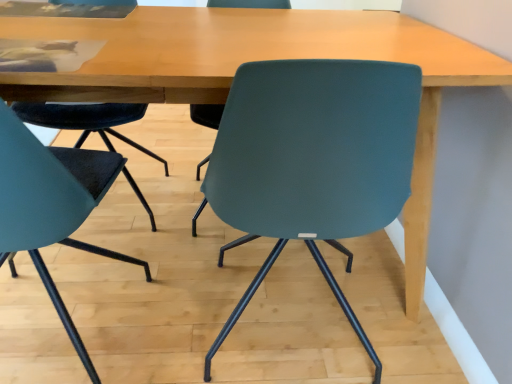
Question: Is the depth of teal matte chair at center, the 1th chair when ordered from right to left, less than that of teal matte chair at left, the 2th chair viewed from the right?

Choices:
 (A) no
 (B) yes

Answer: (A)

Question: Is the surface of teal matte chair at center, which is the 2th chair from left to right, in direct contact with teal matte chair at left, the 2th chair viewed from the right?

Choices:
 (A) no
 (B) yes

Answer: (A)

Question: Does teal matte chair at center, which is the 2th chair from left to right, have a smaller size compared to teal matte chair at left, positioned as the first chair in left-to-right order?

Choices:
 (A) yes
 (B) no

Answer: (B)

Question: Considering the relative sizes of teal matte chair at center, which is the 2th chair from left to right, and teal matte chair at left, positioned as the first chair in left-to-right order, in the image provided, is teal matte chair at center, which is the 2th chair from left to right, shorter than teal matte chair at left, positioned as the first chair in left-to-right order,?

Choices:
 (A) yes
 (B) no

Answer: (A)

Question: Is teal matte chair at center, the 1th chair when ordered from right to left, not inside teal matte chair at left, positioned as the first chair in left-to-right order?

Choices:
 (A) no
 (B) yes

Answer: (B)

Question: Can you confirm if teal matte chair at center, the 1th chair when ordered from right to left, is thinner than teal matte chair at left, the 2th chair viewed from the right?

Choices:
 (A) yes
 (B) no

Answer: (B)

Question: Can you confirm if teal matte chair at left, the 2th chair viewed from the right, is taller than teal matte chair at center, which is the 2th chair from left to right?

Choices:
 (A) yes
 (B) no

Answer: (A)

Question: Can you confirm if teal matte chair at left, positioned as the first chair in left-to-right order, is positioned to the right of teal matte chair at center, which is the 2th chair from left to right?

Choices:
 (A) no
 (B) yes

Answer: (A)

Question: Are teal matte chair at left, the 2th chair viewed from the right, and teal matte chair at center, which is the 2th chair from left to right, far apart?

Choices:
 (A) no
 (B) yes

Answer: (A)

Question: Considering the relative positions of teal matte chair at left, the 2th chair viewed from the right, and teal matte chair at center, the 1th chair when ordered from right to left, in the image provided, is teal matte chair at left, the 2th chair viewed from the right, to the left of teal matte chair at center, the 1th chair when ordered from right to left, from the viewer's perspective?

Choices:
 (A) no
 (B) yes

Answer: (B)

Question: Does teal matte chair at left, positioned as the first chair in left-to-right order, have a lesser height compared to teal matte chair at center, the 1th chair when ordered from right to left?

Choices:
 (A) yes
 (B) no

Answer: (B)

Question: Is teal matte chair at left, the 2th chair viewed from the right, aimed at teal matte chair at center, which is the 2th chair from left to right?

Choices:
 (A) yes
 (B) no

Answer: (B)

Question: Considering the positions of point (279, 221) and point (5, 230), is point (279, 221) closer or farther from the camera than point (5, 230)?

Choices:
 (A) farther
 (B) closer

Answer: (A)